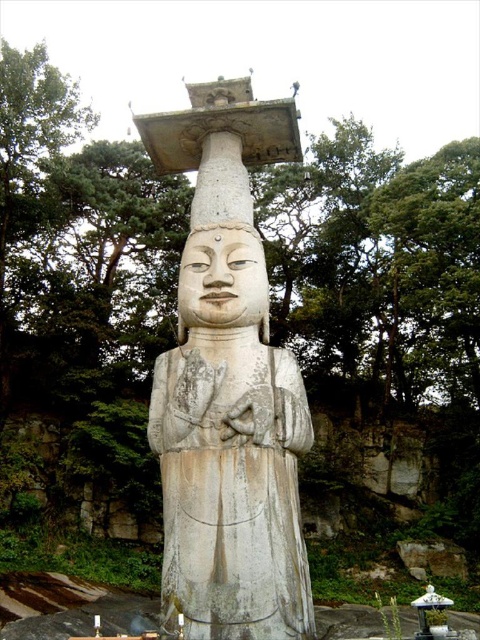
Question: Can you confirm if white stone statue at center is bigger than white stone head at center?

Choices:
 (A) no
 (B) yes

Answer: (B)

Question: Is white stone statue at center further to the viewer compared to white stone head at center?

Choices:
 (A) no
 (B) yes

Answer: (A)

Question: Which point is farther to the camera?

Choices:
 (A) white stone head at center
 (B) white stone statue at center

Answer: (A)

Question: Which of the following is the farthest from the observer?

Choices:
 (A) (263, 253)
 (B) (225, 221)

Answer: (B)

Question: Does white stone statue at center have a greater width compared to white stone head at center?

Choices:
 (A) no
 (B) yes

Answer: (A)